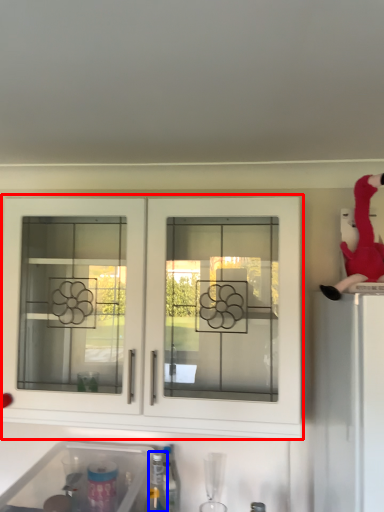
Question: Which object is closer to the camera taking this photo, cabinetry (highlighted by a red box) or bottle (highlighted by a blue box)?

Choices:
 (A) cabinetry
 (B) bottle

Answer: (A)